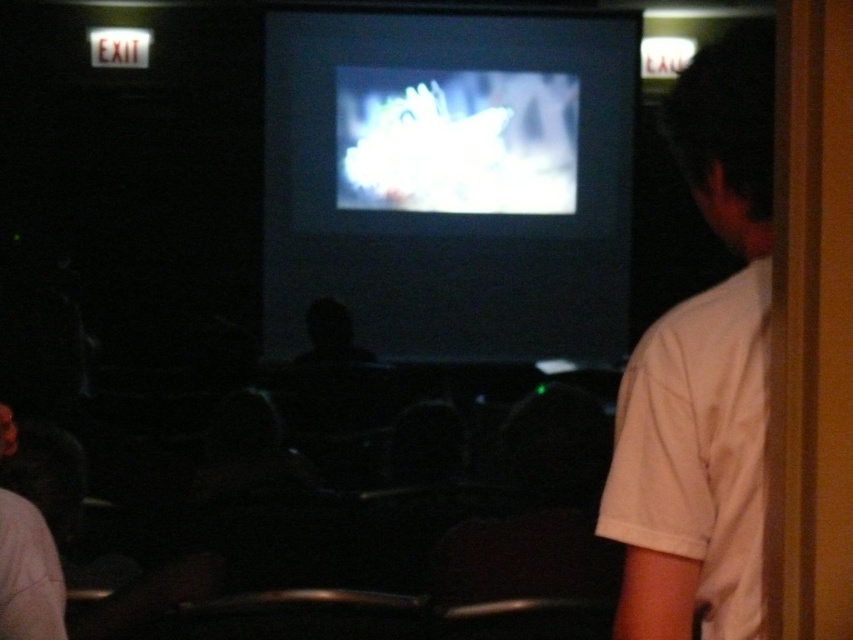
You are a moviegoer sitting in the theater. You notice the matte black screen at center and the white cotton shirt at right. Which object occupies more space in the image?

The matte black screen at center is bigger than the white cotton shirt at right, so the matte black screen at center occupies more space in the image.

You are a moviegoer sitting in the front row of the theater. You notice a specific point in the image at coordinates point (450, 180). What object is located at that point?

The point (450, 180) corresponds to the matte black screen at center.

You are sitting in the movie theater and want to know which of the two points, point (x=328, y=156) or point (x=608, y=481), is closer to you. Can you determine this based on their positions?

Point (x=328, y=156) is further to the camera than point (x=608, y=481), so the closer point to you is point (x=608, y=481).